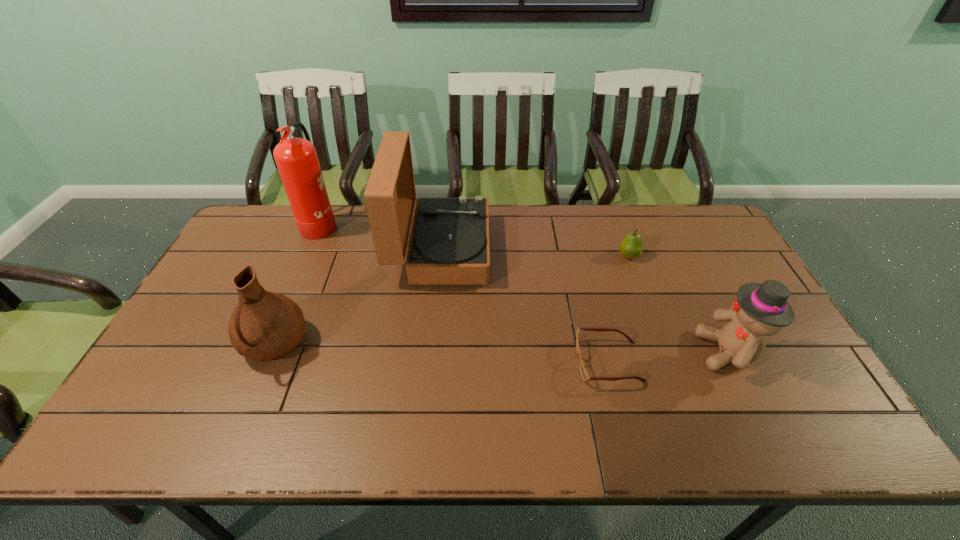
At what (x,y) coordinates should I click in order to perform the action: click on vacant position located 0.360m on the face of the phonograph record. Please return your answer as a coordinate pair (x, y). Looking at the image, I should click on (598, 250).

The image size is (960, 540). Find the location of `free space located on the side of the pitcher with the handle`. free space located on the side of the pitcher with the handle is located at coordinates (244, 419).

Find the location of a particular element. free space located on the front-facing side of the rightmost object is located at coordinates (607, 352).

The width and height of the screenshot is (960, 540). Identify the location of free point located 0.240m on the front-facing side of the rightmost object. pos(607,352).

Where is `vacant point located on the front-facing side of the rightmost object`? The width and height of the screenshot is (960, 540). vacant point located on the front-facing side of the rightmost object is located at coordinates (614, 352).

I want to click on vacant space situated on the front of the second shortest object, so click(652, 318).

At what (x,y) coordinates should I click in order to perform the action: click on free point located 0.220m on the front-facing side of the shortest object. Please return your answer as a coordinate pair (x, y). The height and width of the screenshot is (540, 960). Looking at the image, I should click on (491, 362).

Identify the location of vacant space positioned 0.250m on the front-facing side of the shortest object. This screenshot has width=960, height=540. (479, 362).

This screenshot has width=960, height=540. I want to click on vacant point located 0.280m on the front-facing side of the shortest object, so click(x=468, y=362).

Identify the location of fire extinguisher present at the far edge. (296, 158).